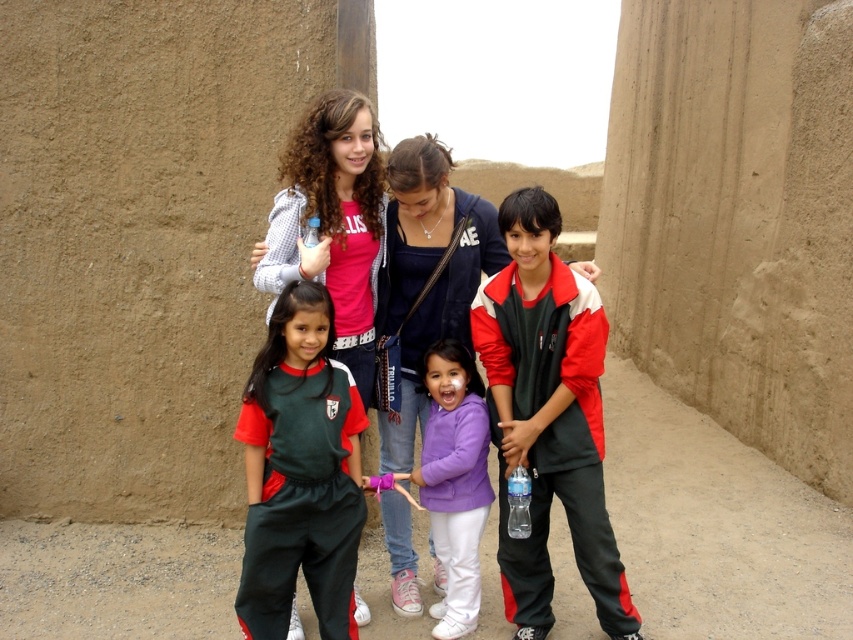
Is point (339, 410) closer to viewer compared to point (453, 401)?

Yes, point (339, 410) is closer to viewer.

Is dark green jersey at center to the right of purple fleece jacket at center from the viewer's perspective?

In fact, dark green jersey at center is to the left of purple fleece jacket at center.

Is point (314, 465) positioned before point (425, 456)?

Yes, point (314, 465) is in front of point (425, 456).

The width and height of the screenshot is (853, 640). Identify the location of dark green jersey at center. (300, 472).

Does red and white jacket at center have a larger size compared to clear plastic bottle at center?

Yes.

Does red and white jacket at center have a lesser height compared to clear plastic bottle at center?

Incorrect, red and white jacket at center's height does not fall short of clear plastic bottle at center's.

At what (x,y) coordinates should I click in order to perform the action: click on red and white jacket at center. Please return your answer as a coordinate pair (x, y). The image size is (853, 640). Looking at the image, I should click on (548, 417).

This screenshot has height=640, width=853. I want to click on red and white jacket at center, so click(x=548, y=417).

Does purple fleece jacket at center appear under clear plastic bottle at center?

Incorrect, purple fleece jacket at center is not positioned below clear plastic bottle at center.

Can you confirm if purple fleece jacket at center is thinner than clear plastic bottle at center?

In fact, purple fleece jacket at center might be wider than clear plastic bottle at center.

This screenshot has height=640, width=853. I want to click on purple fleece jacket at center, so click(454, 481).